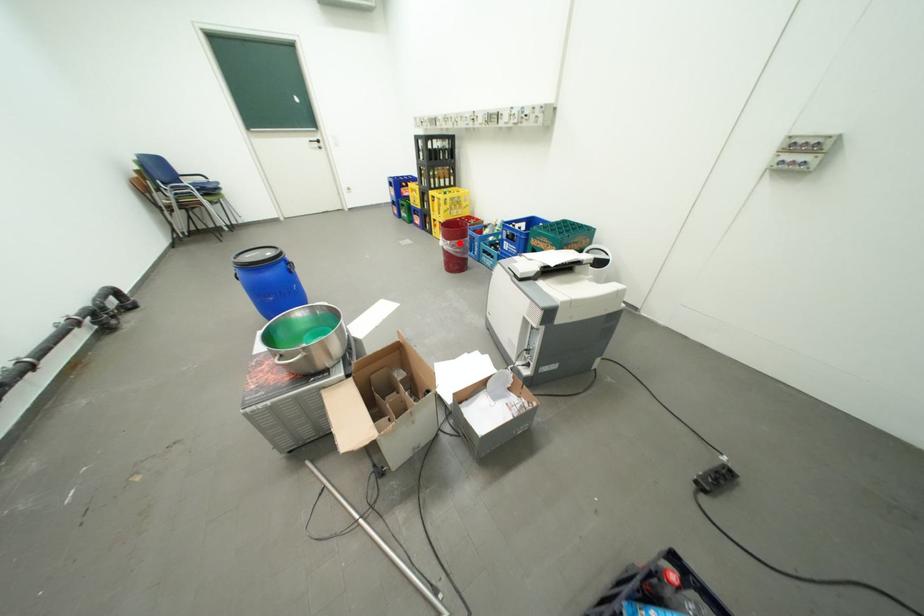
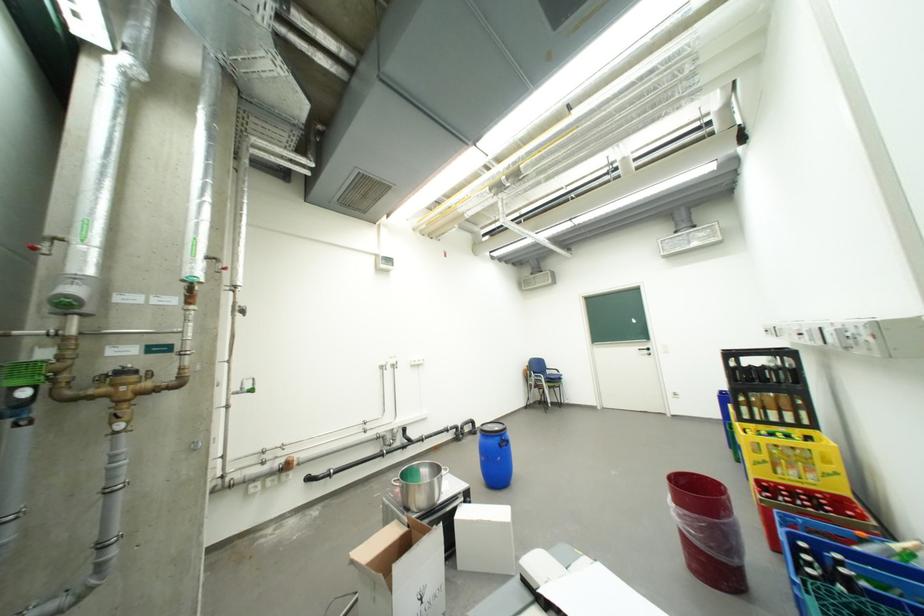
In the second image, find the point that corresponds to the highlighted location in the first image.

(685, 507)